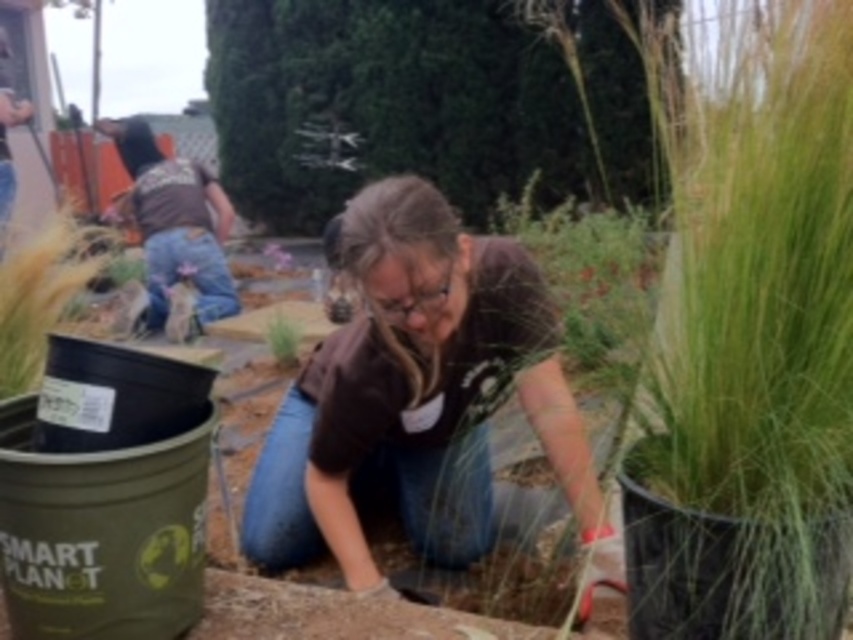
What is located at the coordinates point (415,394) in the image?

The brown cotton shirt at center is located at point (415,394).

You are standing at the point labeled as point [384,280] and want to throw a small pebble to someone standing 2 meters away from you. Can you reach them?

The distance between point [384,280] and the viewer is 1.94 meters, so yes, you can reach the person since the distance is slightly less than 2 meters.

Based on the photo, you are a fashion designer observing the outdoor scene. You notice the brown cotton shirt at center and the green matte plant at center. Which object is wider?

The brown cotton shirt at center is wider than the green matte plant at center.